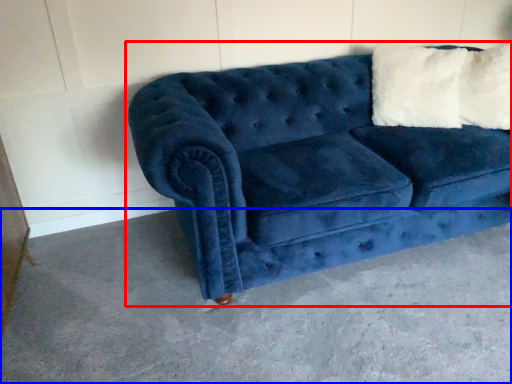
Question: Which object appears farthest to the camera in this image, studio couch (highlighted by a red box) or concrete (highlighted by a blue box)?

Choices:
 (A) studio couch
 (B) concrete

Answer: (A)